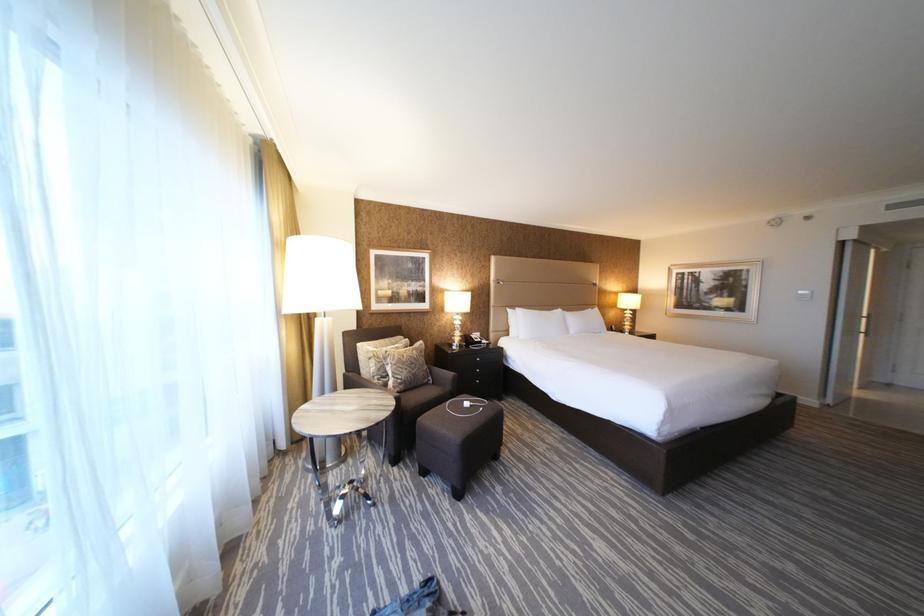
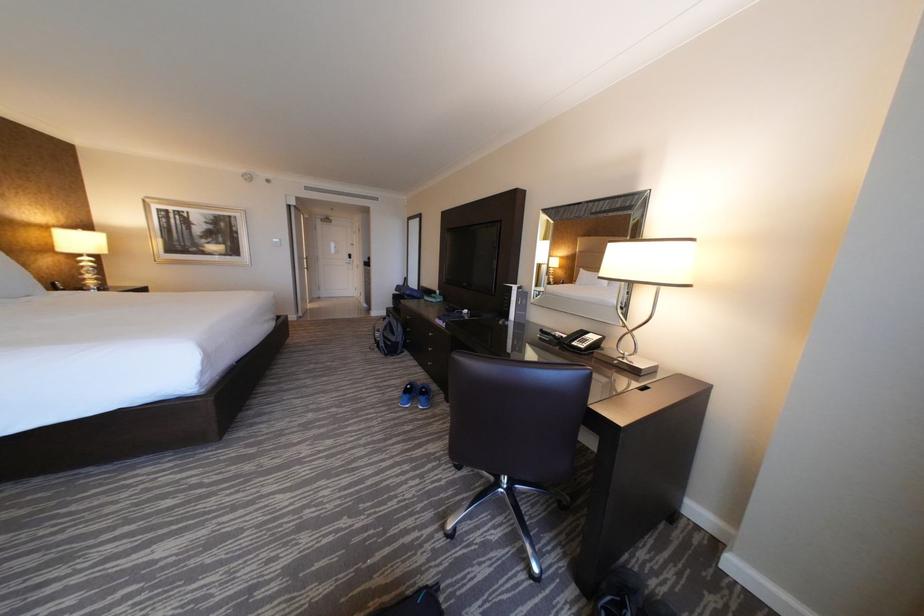
Question: Based on the continuous images, in which direction is the camera rotating? Reply with the corresponding letter.

Choices:
 (A) Left
 (B) Right
 (C) Up
 (D) Down

Answer: (B)